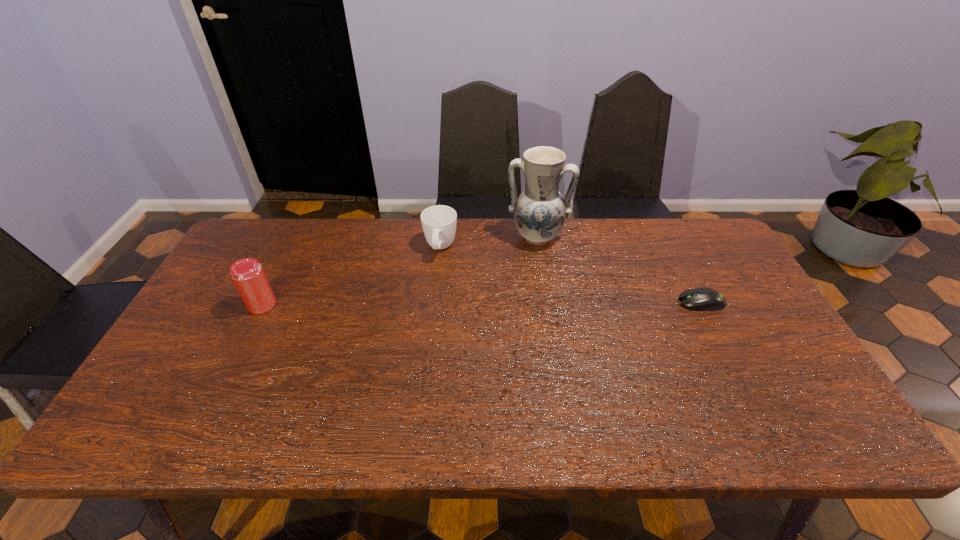
Locate an element on the screen. vacant space on the desktop that is between the leftmost object and the computer mouse and is positioned on either side of the second object from right to left is located at coordinates (530, 303).

Where is `free space on the desktop that is between the third shortest object and the shortest object and is positioned with the handle on the side of the second shortest object`? free space on the desktop that is between the third shortest object and the shortest object and is positioned with the handle on the side of the second shortest object is located at coordinates (430, 304).